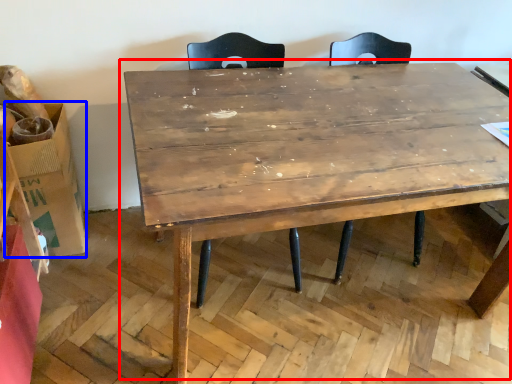
Question: Which object appears farthest to the camera in this image, table (highlighted by a red box) or cardboard box (highlighted by a blue box)?

Choices:
 (A) table
 (B) cardboard box

Answer: (B)